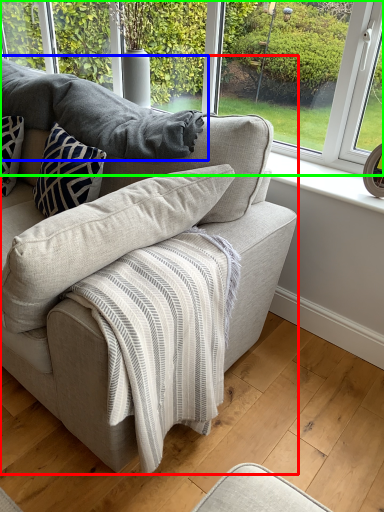
Question: Which is nearer to the studio couch (highlighted by a red box)? gray (highlighted by a blue box) or window (highlighted by a green box).

Choices:
 (A) gray
 (B) window

Answer: (A)